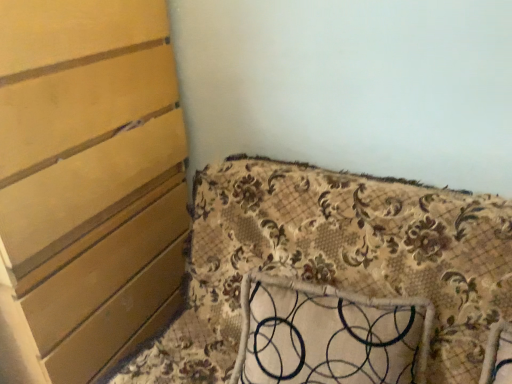
Describe the element at coordinates (334, 260) in the screenshot. I see `floral fabric cushion at lower right` at that location.

At what (x,y) coordinates should I click in order to perform the action: click on floral fabric pillow at center. Please return your answer as a coordinate pair (x, y). Looking at the image, I should click on [328, 335].

Does point (165, 191) come in front of point (337, 304)?

No, it is behind (337, 304).

Is matte wood chest of drawers at left to the left of floral fabric pillow at center from the viewer's perspective?

Yes, matte wood chest of drawers at left is to the left of floral fabric pillow at center.

From a real-world perspective, who is located lower, matte wood chest of drawers at left or floral fabric pillow at center?

In real-world perspective, floral fabric pillow at center is lower.

Considering the positions of point (94, 76) and point (426, 201), is point (94, 76) closer or farther from the camera than point (426, 201)?

Point (94, 76) appears to be farther away from the viewer than point (426, 201).

From a real-world perspective, which is physically above, matte wood chest of drawers at left or floral fabric cushion at lower right?

matte wood chest of drawers at left is physically above.

Is the position of matte wood chest of drawers at left less distant than that of floral fabric cushion at lower right?

No, matte wood chest of drawers at left is further to the viewer.

Considering the relative positions of floral fabric pillow at center and matte wood chest of drawers at left in the image provided, is floral fabric pillow at center to the left of matte wood chest of drawers at left from the viewer's perspective?

Incorrect, floral fabric pillow at center is not on the left side of matte wood chest of drawers at left.

How different are the orientations of floral fabric pillow at center and matte wood chest of drawers at left in degrees?

There is a 85.1-degree angle between the facing directions of floral fabric pillow at center and matte wood chest of drawers at left.

Is floral fabric pillow at center not close to matte wood chest of drawers at left?

floral fabric pillow at center is actually quite close to matte wood chest of drawers at left.

Can you confirm if floral fabric pillow at center is shorter than matte wood chest of drawers at left?

Yes.

Which is behind, point (434, 300) or point (52, 220)?

Point (52, 220)

Is floral fabric cushion at lower right positioned with its back to matte wood chest of drawers at left?

floral fabric cushion at lower right does not have its back to matte wood chest of drawers at left.

From the picture: Is floral fabric cushion at lower right positioned in front of matte wood chest of drawers at left?

Yes.

Are floral fabric cushion at lower right and matte wood chest of drawers at left making contact?

floral fabric cushion at lower right is not next to matte wood chest of drawers at left, and they're not touching.

Who is taller, floral fabric pillow at center or floral fabric cushion at lower right?

Standing taller between the two is floral fabric cushion at lower right.

Which object is further away from the camera, floral fabric pillow at center or floral fabric cushion at lower right?

floral fabric pillow at center is more distant.

From a real-world perspective, which is physically below, floral fabric pillow at center or floral fabric cushion at lower right?

From a 3D spatial view, floral fabric pillow at center is below.

From the image's perspective, which object appears higher, floral fabric cushion at lower right or floral fabric pillow at center?

floral fabric cushion at lower right is shown above in the image.

Considering the sizes of objects floral fabric cushion at lower right and floral fabric pillow at center in the image provided, who is wider, floral fabric cushion at lower right or floral fabric pillow at center?

floral fabric cushion at lower right.

Between floral fabric cushion at lower right and floral fabric pillow at center, which one appears on the right side from the viewer's perspective?

Positioned to the right is floral fabric pillow at center.

At what (x,y) coordinates should I click in order to perform the action: click on pillow below the matte wood chest of drawers at left (from the image's perspective). Please return your answer as a coordinate pair (x, y). The width and height of the screenshot is (512, 384). Looking at the image, I should click on (328, 335).

Locate an element on the screen. The height and width of the screenshot is (384, 512). chest of drawers that appears on the left of floral fabric cushion at lower right is located at coordinates (88, 180).

From the picture: Looking at the image, which one is located closer to matte wood chest of drawers at left, floral fabric cushion at lower right or floral fabric pillow at center?

Among the two, floral fabric cushion at lower right is located nearer to matte wood chest of drawers at left.

When comparing their distances from floral fabric pillow at center, does matte wood chest of drawers at left or floral fabric cushion at lower right seem further?

Among the two, matte wood chest of drawers at left is located further to floral fabric pillow at center.

Which object lies further to the anchor point floral fabric pillow at center, floral fabric cushion at lower right or matte wood chest of drawers at left?

Among the two, matte wood chest of drawers at left is located further to floral fabric pillow at center.

Based on their spatial positions, is matte wood chest of drawers at left or floral fabric pillow at center closer to floral fabric cushion at lower right?

floral fabric pillow at center is positioned closer to the anchor floral fabric cushion at lower right.

When comparing their distances from floral fabric cushion at lower right, does floral fabric pillow at center or matte wood chest of drawers at left seem closer?

The object closer to floral fabric cushion at lower right is floral fabric pillow at center.

Looking at the image, which one is located further to matte wood chest of drawers at left, floral fabric pillow at center or floral fabric cushion at lower right?

floral fabric pillow at center lies further to matte wood chest of drawers at left than the other object.

Find the location of `furniture between matte wood chest of drawers at left and floral fabric pillow at center from left to right`. furniture between matte wood chest of drawers at left and floral fabric pillow at center from left to right is located at coordinates (334, 260).